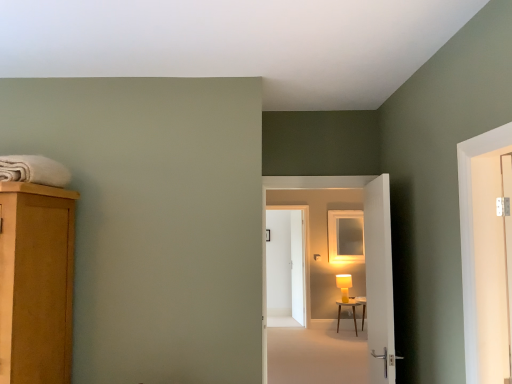
What do you see at coordinates (34, 170) in the screenshot?
I see `white soft towel at upper left` at bounding box center [34, 170].

Find the location of a particular element. This screenshot has width=512, height=384. white glossy door at center-right, the third door from the back is located at coordinates (379, 280).

Where is `wooden side table at center`? The width and height of the screenshot is (512, 384). wooden side table at center is located at coordinates (353, 313).

Locate an element on the screen. The image size is (512, 384). white glossy screen door at right, which is the 2th screen door from left to right is located at coordinates (490, 267).

Relative to white glossy door at center-right, which ranks as the 1th door in front-to-back order, is matte white medicine cabinet at center in front or behind?

matte white medicine cabinet at center is positioned farther from the viewer than white glossy door at center-right, which ranks as the 1th door in front-to-back order.

Consider the image. Between matte white medicine cabinet at center and white glossy door at center-right, the third door from the back, which one has larger size?

Bigger between the two is white glossy door at center-right, the third door from the back.

Does matte white medicine cabinet at center touch white glossy door at center-right, the third door from the back?

No, matte white medicine cabinet at center is not beside white glossy door at center-right, the third door from the back.

Considering the positions of point (344, 230) and point (375, 194), is point (344, 230) closer or farther from the camera than point (375, 194)?

Point (344, 230) is farther from the camera than point (375, 194).

Is yellow matte table lamp at center closer to the viewer compared to white glossy door at center-right, the third door from the back?

No, yellow matte table lamp at center is behind white glossy door at center-right, the third door from the back.

Is yellow matte table lamp at center facing towards white glossy door at center-right, the third door from the back?

Yes, yellow matte table lamp at center is oriented towards white glossy door at center-right, the third door from the back.

Which point is more distant from viewer, [347,292] or [371,341]?

The point [347,292] is farther from the camera.

Could white glossy door at center-right, the third door from the back, be considered to be inside yellow matte table lamp at center?

No, white glossy door at center-right, the third door from the back, is not surrounded by yellow matte table lamp at center.

From a real-world perspective, which object stands above the other?

white glossy door at center, marked as the 2th door in a back-to-front arrangement, is physically above.

Can you confirm if white glossy screen door at center, which is counted as the second screen door, starting from the right, is positioned to the right of white glossy door at center, marked as the 2th door in a back-to-front arrangement?

Correct, you'll find white glossy screen door at center, which is counted as the second screen door, starting from the right, to the right of white glossy door at center, marked as the 2th door in a back-to-front arrangement.

How many degrees apart are the facing directions of white glossy screen door at center, which is counted as the first screen door, starting from the left, and white glossy door at center, the 2th door from the front?

The angular difference between white glossy screen door at center, which is counted as the first screen door, starting from the left, and white glossy door at center, the 2th door from the front, is 82.3 degrees.

Does point (294, 278) come in front of point (375, 266)?

No.

Considering the sizes of objects white glossy door at center, marked as the 2th door in a back-to-front arrangement, and matte white medicine cabinet at center in the image provided, who is smaller, white glossy door at center, marked as the 2th door in a back-to-front arrangement, or matte white medicine cabinet at center?

matte white medicine cabinet at center is smaller.

Is white glossy door at center, the 2th door from the front, placed right next to matte white medicine cabinet at center?

white glossy door at center, the 2th door from the front, and matte white medicine cabinet at center are not in contact.

Who is more distant, white glossy door at center, the 2th door from the front, or matte white medicine cabinet at center?

Positioned behind is matte white medicine cabinet at center.

Which of these two, white glossy door at center, the 2th door from the front, or matte white medicine cabinet at center, is thinner?

matte white medicine cabinet at center is thinner.

From the image's perspective, relative to white glossy screen door at center, the 2th screen door from the front, is white glossy door at center, the 2th door from the front, above or below?

Clearly, from the image's perspective, white glossy door at center, the 2th door from the front, is above white glossy screen door at center, the 2th screen door from the front.

Who is taller, white glossy door at center, the 2th door from the front, or white glossy screen door at center, which is counted as the second screen door, starting from the right?

white glossy screen door at center, which is counted as the second screen door, starting from the right.

How different are the orientations of white glossy door at center, the 2th door from the front, and white glossy screen door at center, the 2th screen door from the front, in degrees?

The angle between the facing direction of white glossy door at center, the 2th door from the front, and the facing direction of white glossy screen door at center, the 2th screen door from the front, is 82.3 degrees.

Considering the relative sizes of white glossy door at center, marked as the 2th door in a back-to-front arrangement, and white glossy screen door at center, the 2th screen door from the front, in the image provided, is white glossy door at center, marked as the 2th door in a back-to-front arrangement, smaller than white glossy screen door at center, the 2th screen door from the front,?

Correct, white glossy door at center, marked as the 2th door in a back-to-front arrangement, occupies less space than white glossy screen door at center, the 2th screen door from the front.

Locate an element on the screen. This screenshot has height=384, width=512. table in front of the matte white medicine cabinet at center is located at coordinates (353, 313).

Is matte white medicine cabinet at center surrounded by wooden side table at center?

No, matte white medicine cabinet at center is not inside wooden side table at center.

Is wooden side table at center to the right of matte white medicine cabinet at center from the viewer's perspective?

Incorrect, wooden side table at center is not on the right side of matte white medicine cabinet at center.

Is white wooden door at center, which appears as the third door when viewed from the front, taller than yellow matte table lamp at center?

Yes.

From a real-world perspective, is white wooden door at center, which ranks as the 1th door in back-to-front order, positioned over yellow matte table lamp at center based on gravity?

Correct, in the physical world, white wooden door at center, which ranks as the 1th door in back-to-front order, is higher than yellow matte table lamp at center.

From the image's perspective, is white wooden door at center, which appears as the third door when viewed from the front, above yellow matte table lamp at center?

Correct, white wooden door at center, which appears as the third door when viewed from the front, appears higher than yellow matte table lamp at center in the image.

Which object is further away from the camera, white wooden door at center, which appears as the third door when viewed from the front, or yellow matte table lamp at center?

white wooden door at center, which appears as the third door when viewed from the front, is behind.

This screenshot has width=512, height=384. Identify the location of door that is the 2nd object located above the matte white medicine cabinet at center (from the image's perspective). (379, 280).

There is a yellow matte table lamp at center. Find the location of `the 2nd door above it (from a real-world perspective)`. the 2nd door above it (from a real-world perspective) is located at coordinates (379, 280).

Looking at the image, which one is located closer to white glossy door at center, marked as the 2th door in a back-to-front arrangement, wooden side table at center or white glossy screen door at center, which is counted as the second screen door, starting from the right?

wooden side table at center.

In the scene shown: Estimate the real-world distances between objects in this image. Which object is closer to white wooden door at center, which ranks as the 1th door in back-to-front order, white glossy door at center-right, which ranks as the 1th door in front-to-back order, or matte white medicine cabinet at center?

matte white medicine cabinet at center lies closer to white wooden door at center, which ranks as the 1th door in back-to-front order, than the other object.

When comparing their distances from white glossy screen door at right, which is the 2th screen door from left to right, does matte white medicine cabinet at center or yellow matte table lamp at center seem closer?

yellow matte table lamp at center is positioned closer to the anchor white glossy screen door at right, which is the 2th screen door from left to right.

Which object lies further to the anchor point matte white medicine cabinet at center, yellow matte table lamp at center or white glossy door at center-right, which ranks as the 1th door in front-to-back order?

white glossy door at center-right, which ranks as the 1th door in front-to-back order, is further to matte white medicine cabinet at center.

Based on their spatial positions, is white glossy door at center-right, the third door from the back, or white glossy screen door at center, which is counted as the first screen door, starting from the left, closer to matte white medicine cabinet at center?

The object closer to matte white medicine cabinet at center is white glossy screen door at center, which is counted as the first screen door, starting from the left.

From the image, which object appears to be nearer to white glossy door at center-right, the third door from the back, white soft towel at upper left or white wooden door at center, which appears as the third door when viewed from the front?

white soft towel at upper left is closer to white glossy door at center-right, the third door from the back.

Looking at the image, which one is located closer to white glossy screen door at center, which is counted as the second screen door, starting from the right, white glossy door at center, the 2th door from the front, or white glossy door at center-right, which ranks as the 1th door in front-to-back order?

The object closer to white glossy screen door at center, which is counted as the second screen door, starting from the right, is white glossy door at center, the 2th door from the front.

From the image, which object appears to be nearer to white glossy screen door at right, which is the 2th screen door from left to right, white glossy door at center, the 2th door from the front, or white glossy screen door at center, which is counted as the second screen door, starting from the right?

Based on the image, white glossy door at center, the 2th door from the front, appears to be nearer to white glossy screen door at right, which is the 2th screen door from left to right.

Where is `bath towel between white glossy screen door at right, which is the 2th screen door from left to right, and wooden side table at center from front to back`? bath towel between white glossy screen door at right, which is the 2th screen door from left to right, and wooden side table at center from front to back is located at coordinates (34, 170).

You are a GUI agent. You are given a task and a screenshot of the screen. Output one action in this format:
    pyautogui.click(x=<x>, y=<y>)
    Task: Click on the door between matte white medicine cabinet at center and wooden side table at center vertically
    Image resolution: width=512 pixels, height=384 pixels.
    Given the screenshot: What is the action you would take?
    click(x=285, y=268)

This screenshot has height=384, width=512. Identify the location of table lamp between white glossy door at center-right, which ranks as the 1th door in front-to-back order, and white glossy screen door at center, the 2th screen door from the front, in the front-back direction. (344, 285).

You are a GUI agent. You are given a task and a screenshot of the screen. Output one action in this format:
    pyautogui.click(x=<x>, y=<y>)
    Task: Click on the table between white soft towel at upper left and white glossy screen door at center, the 2th screen door from the front, in the front-back direction
    The image size is (512, 384).
    Given the screenshot: What is the action you would take?
    pyautogui.click(x=353, y=313)